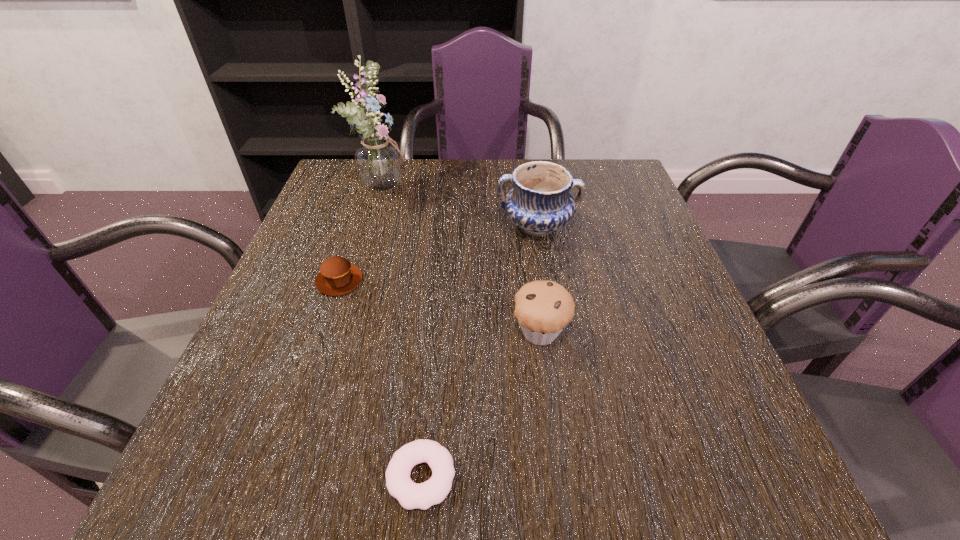
Image resolution: width=960 pixels, height=540 pixels. Identify the location of vacant space located 0.320m on the left of the taller muffin. (340, 332).

What are the coordinates of `free spot located on the front of the fourth tallest object` in the screenshot? It's located at (292, 420).

Find the location of `free location located on the left of the shortest object`. free location located on the left of the shortest object is located at coordinates (351, 477).

This screenshot has height=540, width=960. Identify the location of object that is at the far edge. (378, 160).

At what (x,y) coordinates should I click in order to perform the action: click on object that is at the near edge. Please return your answer as a coordinate pair (x, y). Looking at the image, I should click on (410, 495).

Where is `bouquet that is at the left edge`? This screenshot has height=540, width=960. bouquet that is at the left edge is located at coordinates (378, 160).

Where is `muffin located at the left edge`? muffin located at the left edge is located at coordinates (337, 276).

Identify the location of object located at the far left corner. (378, 160).

This screenshot has width=960, height=540. In order to click on vacant space at the far edge in this screenshot , I will do `click(446, 182)`.

At what (x,y) coordinates should I click in order to perform the action: click on free space at the near edge of the desktop. Please return your answer as a coordinate pair (x, y). Image resolution: width=960 pixels, height=540 pixels. Looking at the image, I should click on (647, 462).